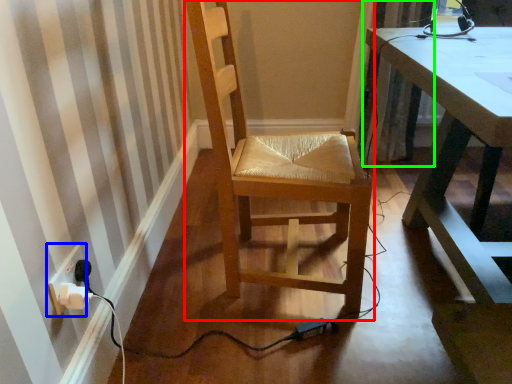
Question: Considering the real-world distances, which object is farthest from chair (highlighted by a red box)? electric outlet (highlighted by a blue box) or curtain (highlighted by a green box)?

Choices:
 (A) electric outlet
 (B) curtain

Answer: (B)